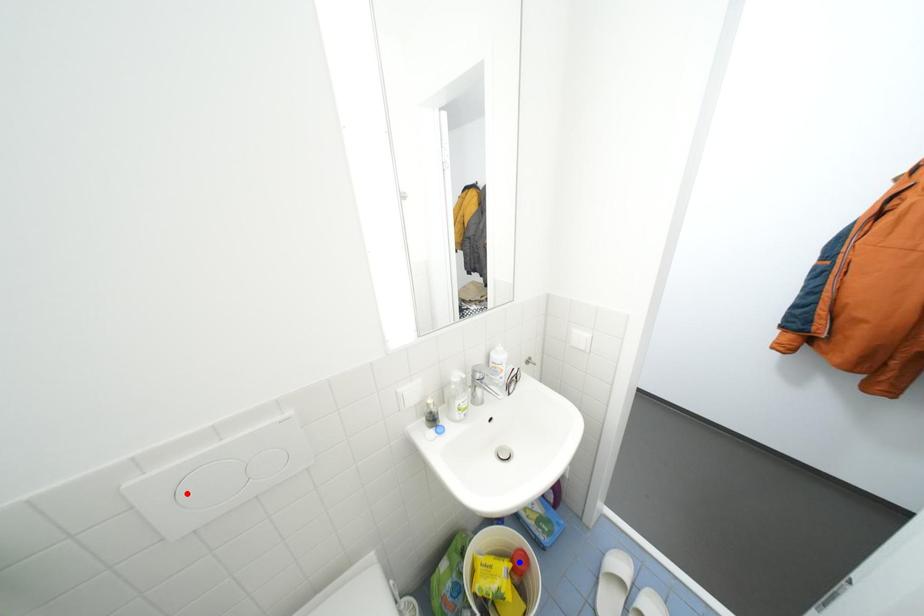
Question: Which of the two points in the image is closer to the camera?

Choices:
 (A) Blue point is closer.
 (B) Red point is closer.

Answer: (B)